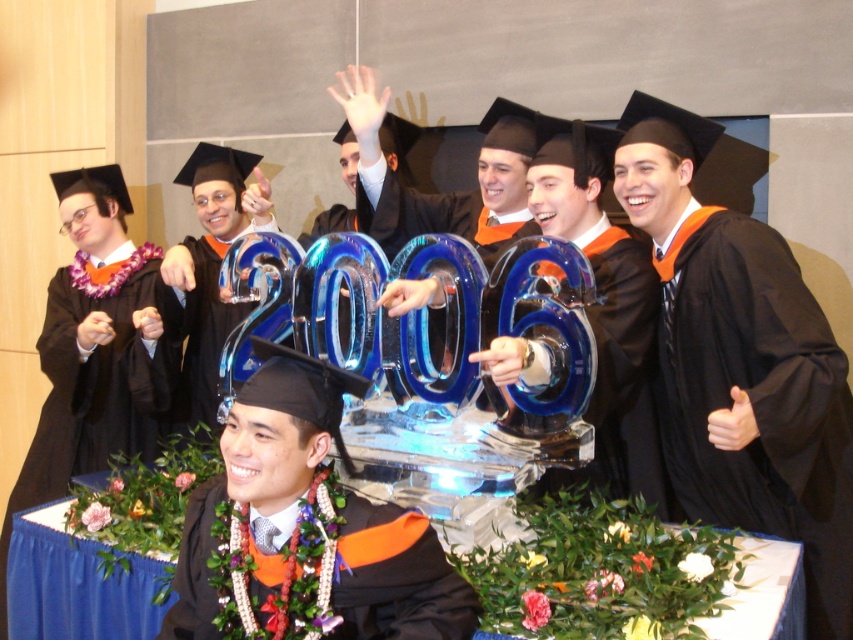
Is point (397, 611) positioned in front of point (215, 310)?

Yes, it is in front of point (215, 310).

Is matte black graduation gown at lower center wider than matte black graduation robe at center?

Yes.

Image resolution: width=853 pixels, height=640 pixels. What do you see at coordinates (398, 577) in the screenshot?
I see `matte black graduation gown at lower center` at bounding box center [398, 577].

Locate an element on the screen. matte black graduation gown at lower center is located at coordinates (398, 577).

Does black matte graduation robe at right have a lesser height compared to matte black graduation robe at center?

In fact, black matte graduation robe at right may be taller than matte black graduation robe at center.

Who is shorter, black matte graduation robe at right or matte black graduation robe at center?

matte black graduation robe at center is shorter.

Is point (718, 339) closer to camera compared to point (213, 419)?

Yes, point (718, 339) is closer to viewer.

You are a GUI agent. You are given a task and a screenshot of the screen. Output one action in this format:
    pyautogui.click(x=<x>, y=<y>)
    Task: Click on the black matte graduation robe at right
    The height and width of the screenshot is (640, 853).
    Given the screenshot: What is the action you would take?
    pyautogui.click(x=757, y=397)

This screenshot has height=640, width=853. What do you see at coordinates (96, 381) in the screenshot?
I see `black matte gown at center` at bounding box center [96, 381].

Which is in front, point (51, 308) or point (260, 586)?

Positioned in front is point (260, 586).

At what (x,y) coordinates should I click in order to perform the action: click on black matte gown at center. Please return your answer as a coordinate pair (x, y). Looking at the image, I should click on (96, 381).